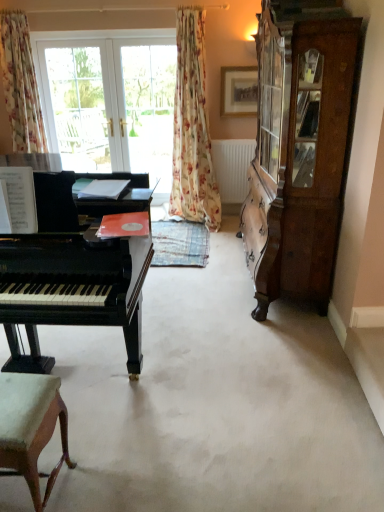
Question: Considering the relative positions of light brown wood chair at lower left and floral fabric curtain at left, which is the second curtain in right-to-left order, in the image provided, is light brown wood chair at lower left to the left of floral fabric curtain at left, which is the second curtain in right-to-left order, from the viewer's perspective?

Choices:
 (A) yes
 (B) no

Answer: (B)

Question: Considering the relative sizes of light brown wood chair at lower left and floral fabric curtain at left, which is counted as the 1th curtain, starting from the left, in the image provided, is light brown wood chair at lower left smaller than floral fabric curtain at left, which is counted as the 1th curtain, starting from the left,?

Choices:
 (A) no
 (B) yes

Answer: (B)

Question: From the image's perspective, is light brown wood chair at lower left located beneath floral fabric curtain at left, which is counted as the 1th curtain, starting from the left?

Choices:
 (A) yes
 (B) no

Answer: (A)

Question: Are light brown wood chair at lower left and floral fabric curtain at left, which is counted as the 1th curtain, starting from the left, located far from each other?

Choices:
 (A) no
 (B) yes

Answer: (B)

Question: Could floral fabric curtain at left, which is counted as the 1th curtain, starting from the left, be considered to be inside light brown wood chair at lower left?

Choices:
 (A) yes
 (B) no

Answer: (B)

Question: From a real-world perspective, is wooden picture frame at upper center physically located above or below wooden cabinet at right?

Choices:
 (A) above
 (B) below

Answer: (A)

Question: In terms of height, does wooden picture frame at upper center look taller or shorter compared to wooden cabinet at right?

Choices:
 (A) tall
 (B) short

Answer: (B)

Question: Is wooden picture frame at upper center wider or thinner than wooden cabinet at right?

Choices:
 (A) wide
 (B) thin

Answer: (B)

Question: From the image's perspective, is wooden picture frame at upper center located above or below wooden cabinet at right?

Choices:
 (A) above
 (B) below

Answer: (A)

Question: From a real-world perspective, is floral fabric curtain at center, the first curtain viewed from the right, positioned above or below light brown wood chair at lower left?

Choices:
 (A) above
 (B) below

Answer: (A)

Question: Which is correct: floral fabric curtain at center, the 2th curtain when ordered from left to right, is inside light brown wood chair at lower left, or outside of it?

Choices:
 (A) outside
 (B) inside

Answer: (A)

Question: In terms of size, does floral fabric curtain at center, the 2th curtain when ordered from left to right, appear bigger or smaller than light brown wood chair at lower left?

Choices:
 (A) big
 (B) small

Answer: (A)

Question: Would you say floral fabric curtain at center, the 2th curtain when ordered from left to right, is to the left or to the right of light brown wood chair at lower left in the picture?

Choices:
 (A) left
 (B) right

Answer: (B)

Question: Looking at their shapes, would you say floral fabric curtain at center, the 2th curtain when ordered from left to right, is wider or thinner than white matte radiator at center?

Choices:
 (A) thin
 (B) wide

Answer: (B)

Question: Is floral fabric curtain at center, the 2th curtain when ordered from left to right, to the left or to the right of white matte radiator at center in the image?

Choices:
 (A) left
 (B) right

Answer: (A)